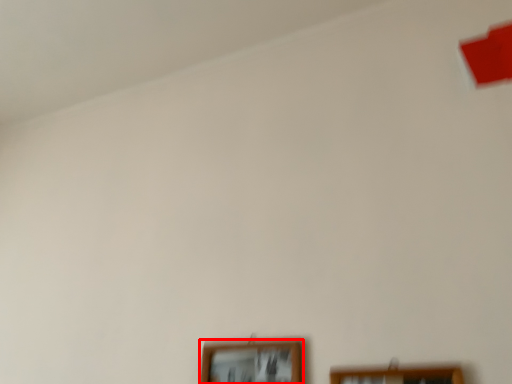
Question: From the image, what is the correct spatial relationship of picture frame (annotated by the red box) in relation to picture frame?

Choices:
 (A) left
 (B) right

Answer: (A)